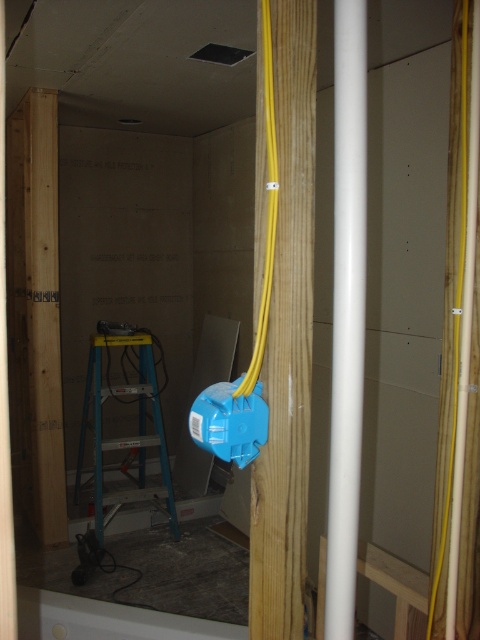
You are an electrician working in this construction site. You need to install a new electrical outlet. The outlet requires a connection to both the white smooth pipe at center and the yellow rubber cable at center. Since the outlet must be placed in a position where both are accessible, where should you position it relative to their current locations?

The white smooth pipe at center is located below the yellow rubber cable at center. To access both, the outlet should be positioned between them, ensuring it is above the white smooth pipe at center and below the yellow rubber cable at center.

You are an electrician working in this construction site and need to install a new electrical outlet. You have a tool that requires a conduit with a diameter of 3 inches. Can the white smooth pipe at center accommodate the yellow rubber cable at center and the new conduit?

The white smooth pipe at center has a larger size compared to yellow rubber cable at center, so it can accommodate both the yellow rubber cable at center and the new conduit if the total diameter does not exceed the pipe capacity.

You are a construction worker needing to access the ceiling vent for inspection. You see a blue plastic ladder at center and a yellow rubber cable at center. Which object should you move first to safely reach the vent?

The blue plastic ladder at center is located below the yellow rubber cable at center. To safely reach the vent, you should move the yellow rubber cable at center first, as it is above the ladder and might interfere with climbing.